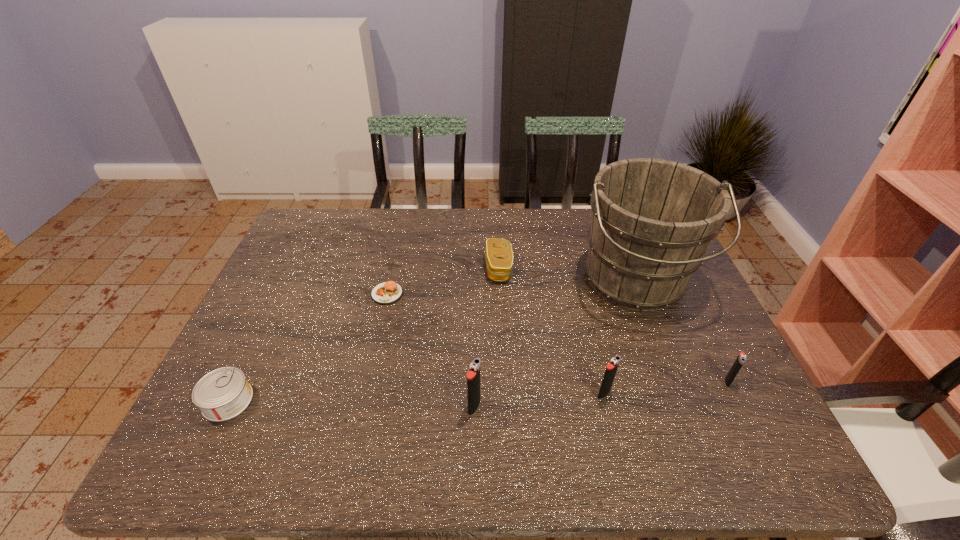
I want to click on vacant space situated 0.120m on the handle side of the bucket, so click(667, 365).

Locate an element on the screen. vacant area situated on the right of the leftmost object is located at coordinates (327, 401).

Image resolution: width=960 pixels, height=540 pixels. What are the coordinates of `object located at the far edge` in the screenshot? It's located at (652, 221).

Find the location of a particular element. can at the near edge is located at coordinates (224, 393).

This screenshot has width=960, height=540. What are the coordinates of `object that is at the left edge` in the screenshot? It's located at (224, 393).

Where is `igniter at the right edge`? This screenshot has height=540, width=960. igniter at the right edge is located at coordinates (741, 358).

Find the location of a particular element. bucket that is at the right edge is located at coordinates (652, 221).

Locate an element on the screen. object that is at the near left corner is located at coordinates (224, 393).

Locate an element on the screen. object that is at the far right corner is located at coordinates (652, 221).

Locate an element on the screen. Image resolution: width=960 pixels, height=540 pixels. vacant space at the far edge of the desktop is located at coordinates (449, 218).